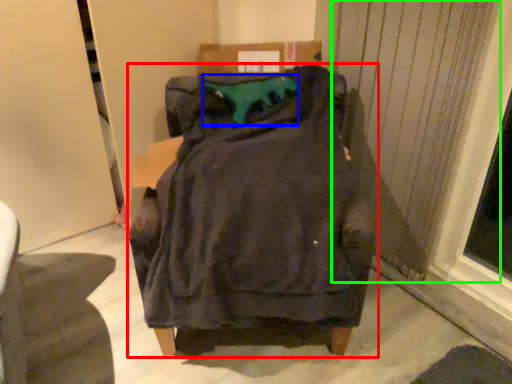
Question: Based on their relative distances, which object is nearer to furniture (highlighted by a red box)? Choose from teal (highlighted by a blue box) and curtain (highlighted by a green box).

Choices:
 (A) teal
 (B) curtain

Answer: (A)